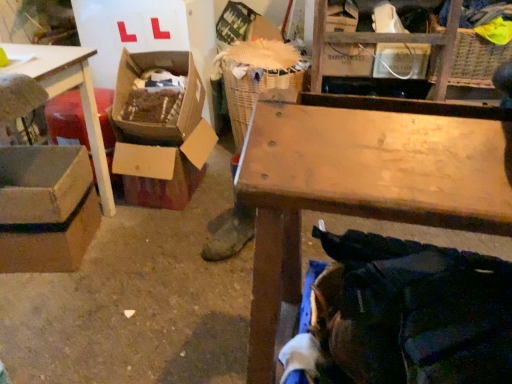
Question: Would you say wooden crate at upper center contains cardboard box at center-left, the 2th box when ordered from left to right?

Choices:
 (A) yes
 (B) no

Answer: (B)

Question: Is wooden crate at upper center not close to cardboard box at center-left, the 2th box when ordered from left to right?

Choices:
 (A) no
 (B) yes

Answer: (A)

Question: Considering the relative sizes of wooden crate at upper center and cardboard box at center-left, the 2th box when ordered from left to right, in the image provided, is wooden crate at upper center wider than cardboard box at center-left, the 2th box when ordered from left to right,?

Choices:
 (A) yes
 (B) no

Answer: (B)

Question: Considering the relative sizes of wooden crate at upper center and cardboard box at center-left, the 2th box when ordered from left to right, in the image provided, is wooden crate at upper center taller than cardboard box at center-left, the 2th box when ordered from left to right,?

Choices:
 (A) no
 (B) yes

Answer: (B)

Question: Is wooden crate at upper center next to cardboard box at center-left, marked as the 1th box in a right-to-left arrangement?

Choices:
 (A) no
 (B) yes

Answer: (A)

Question: Is wooden crate at upper center positioned before cardboard box at center-left, marked as the 1th box in a right-to-left arrangement?

Choices:
 (A) yes
 (B) no

Answer: (B)

Question: Considering the relative positions of cardboard box at center-left, the 2th box when ordered from left to right, and cardboard box at left in the image provided, is cardboard box at center-left, the 2th box when ordered from left to right, to the left of cardboard box at left from the viewer's perspective?

Choices:
 (A) yes
 (B) no

Answer: (B)

Question: Is cardboard box at center-left, the 2th box when ordered from left to right, oriented away from cardboard box at left?

Choices:
 (A) yes
 (B) no

Answer: (B)

Question: Is cardboard box at center-left, marked as the 1th box in a right-to-left arrangement, outside cardboard box at left?

Choices:
 (A) no
 (B) yes

Answer: (A)

Question: Is cardboard box at center-left, the 2th box when ordered from left to right, in contact with cardboard box at left?

Choices:
 (A) no
 (B) yes

Answer: (A)

Question: From the image's perspective, is cardboard box at center-left, marked as the 1th box in a right-to-left arrangement, over cardboard box at left?

Choices:
 (A) no
 (B) yes

Answer: (A)

Question: Is cardboard box at center-left, the 2th box when ordered from left to right, not near cardboard box at left?

Choices:
 (A) no
 (B) yes

Answer: (A)

Question: From the image's perspective, would you say cardboard box at left is shown under cardboard box at center-left, marked as the 1th box in a right-to-left arrangement?

Choices:
 (A) no
 (B) yes

Answer: (A)